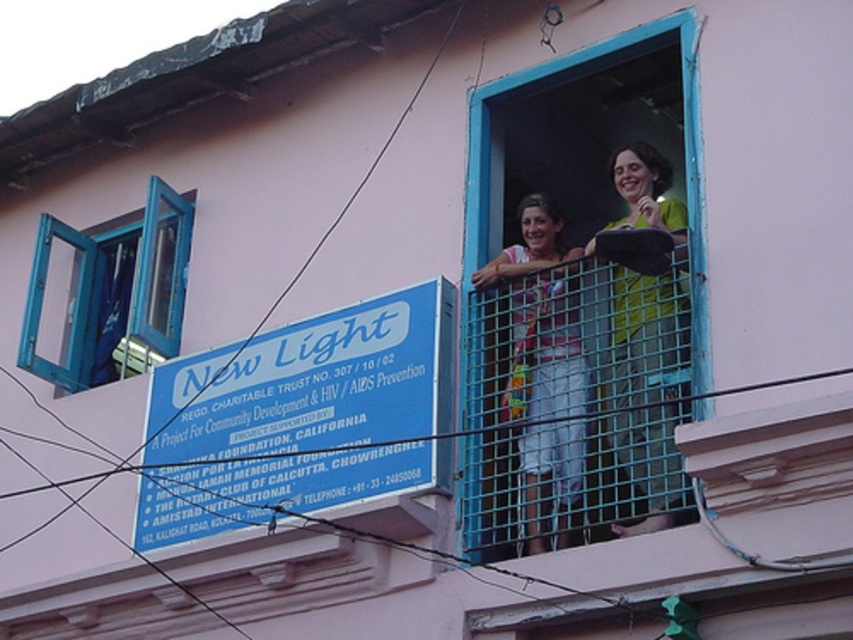
You are an interior designer assessing the balcony for a photoshoot. You need to determine which object takes up more visual space in the scene between the blue painted wood window at left and the green fabric dress at center. Which one is larger in the frame?

The blue painted wood window at left occupies less space than green fabric dress at center, so the green fabric dress at center is larger in the frame.

You are standing on the balcony and want to hand a small gift to someone standing at the edge of the balcony. The gift is currently in your pocket. The two people on the balcony are wearing the green fabric dress at center and the matte pink blouse at center. Which person should you ask to help pass the gift to the edge, considering their positions?

You should ask the person wearing the green fabric dress at center to help pass the gift to the edge because they are closer to the edge of the balcony than the matte pink blouse at center. The distance between them is 4.23 meters, so the green fabric dress at center is nearer to the edge.

You are a photographer on the balcony and want to capture both the green fabric dress at center and the matte pink blouse at center in a single frame. Which one should you position closer to the center of the camera to ensure both are fully visible?

Since the green fabric dress at center is to the right of the matte pink blouse at center, you should position the matte pink blouse at center closer to the center of the camera so that both objects can be captured in the frame without cropping either.